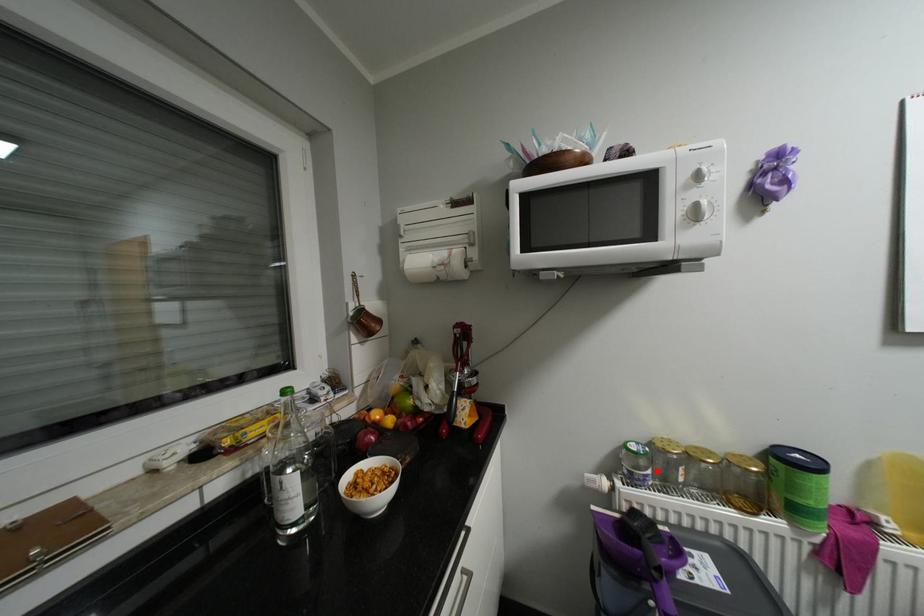
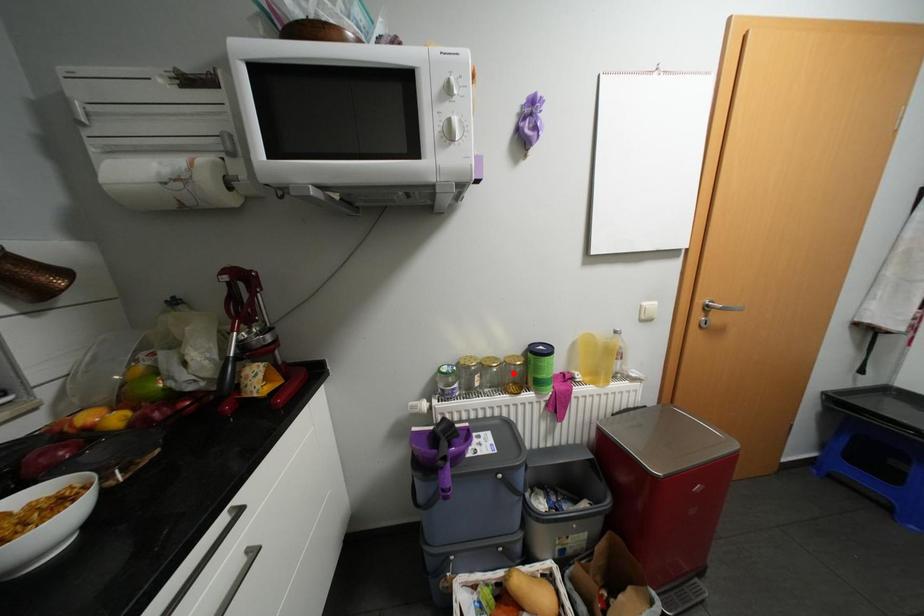
I am providing you with two images of the same scene from different viewpoints. A red point is marked on the first image and another point is marked on the second image. Does the point marked in image1 correspond to the same location as the one in image2?

No